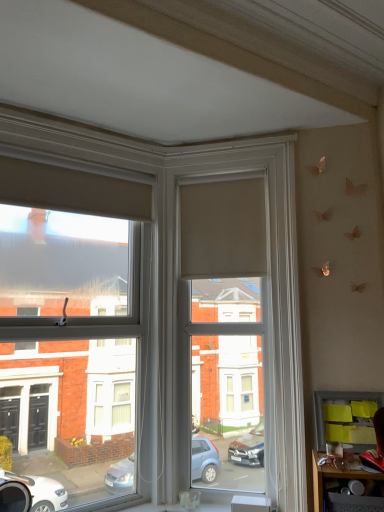
Question: From a real-world perspective, is yellow sticky notes at lower right located higher than matte beige roller blind at center?

Choices:
 (A) no
 (B) yes

Answer: (A)

Question: From the image's perspective, is yellow sticky notes at lower right under matte beige roller blind at center?

Choices:
 (A) yes
 (B) no

Answer: (A)

Question: Does yellow sticky notes at lower right have a greater height compared to matte beige roller blind at center?

Choices:
 (A) no
 (B) yes

Answer: (A)

Question: Is the position of yellow sticky notes at lower right more distant than that of matte beige roller blind at center?

Choices:
 (A) yes
 (B) no

Answer: (B)

Question: Can you confirm if yellow sticky notes at lower right is positioned to the left of matte beige roller blind at center?

Choices:
 (A) no
 (B) yes

Answer: (A)

Question: Considering the relative positions of matte beige roller blind at center and matte black table at lower right in the image provided, is matte beige roller blind at center to the left or to the right of matte black table at lower right?

Choices:
 (A) right
 (B) left

Answer: (B)

Question: Relative to matte black table at lower right, is matte beige roller blind at center in front or behind?

Choices:
 (A) behind
 (B) front

Answer: (A)

Question: Choose the correct answer: Is matte beige roller blind at center inside matte black table at lower right or outside it?

Choices:
 (A) inside
 (B) outside

Answer: (B)

Question: Is matte beige roller blind at center taller or shorter than matte black table at lower right?

Choices:
 (A) tall
 (B) short

Answer: (A)

Question: In terms of height, does matte beige roller blind at center look taller or shorter compared to matte black table at lower right?

Choices:
 (A) short
 (B) tall

Answer: (B)

Question: Is matte beige roller blind at center wider or thinner than matte black table at lower right?

Choices:
 (A) thin
 (B) wide

Answer: (A)

Question: Considering the positions of point (13, 358) and point (382, 476), is point (13, 358) closer or farther from the camera than point (382, 476)?

Choices:
 (A) farther
 (B) closer

Answer: (A)

Question: From the image's perspective, relative to matte black table at lower right, is matte beige roller blind at center above or below?

Choices:
 (A) below
 (B) above

Answer: (B)

Question: Considering the relative positions of matte beige roller blind at center and matte beige roller blind at center in the image provided, is matte beige roller blind at center to the left or to the right of matte beige roller blind at center?

Choices:
 (A) right
 (B) left

Answer: (B)

Question: From a real-world perspective, is matte beige roller blind at center positioned above or below matte beige roller blind at center?

Choices:
 (A) above
 (B) below

Answer: (B)